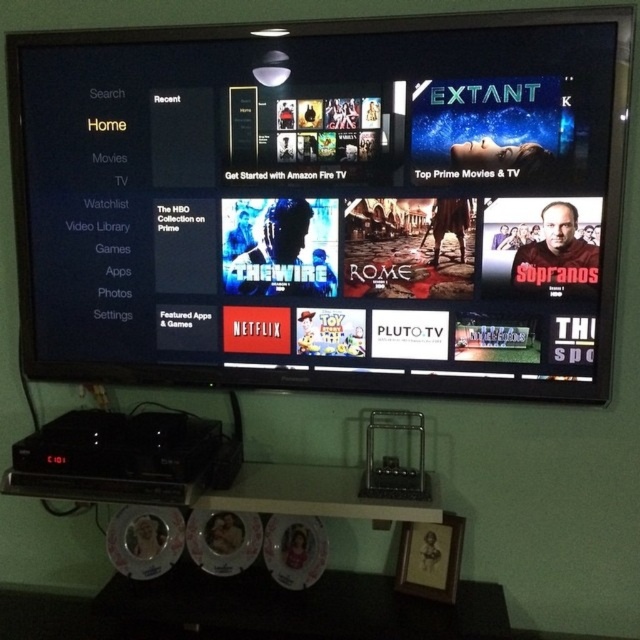
In the scene shown: Does matte plastic dvd at lower center have a smaller size compared to white glossy dvd at lower center?

No.

How much distance is there between matte plastic dvd at lower center and white glossy dvd at lower center?

matte plastic dvd at lower center and white glossy dvd at lower center are 4.44 inches apart from each other.

At what (x,y) coordinates should I click in order to perform the action: click on matte plastic dvd at lower center. Please return your answer as a coordinate pair (x, y). Looking at the image, I should click on [x=224, y=540].

I want to click on matte plastic dvd at lower center, so click(224, 540).

Between white glossy dvd at lower left and matte plastic dvd at lower center, which one has less height?

matte plastic dvd at lower center

Can you confirm if white glossy dvd at lower left is taller than matte plastic dvd at lower center?

Correct, white glossy dvd at lower left is much taller as matte plastic dvd at lower center.

Is point (173, 522) farther from viewer compared to point (204, 538)?

Yes, it is behind point (204, 538).

Image resolution: width=640 pixels, height=640 pixels. Find the location of `white glossy dvd at lower left`. white glossy dvd at lower left is located at coordinates point(145,540).

Does white glossy dvd at lower left lie behind white glossy dvd at lower center?

That is True.

Is white glossy dvd at lower left smaller than white glossy dvd at lower center?

No.

I want to click on white glossy dvd at lower left, so click(145, 540).